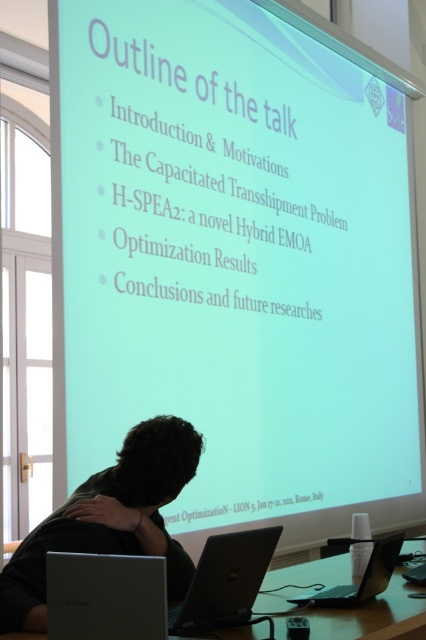
You are a photographer standing at the back of the room. You want to take a photo of the person presenting, focusing on their black matte hair at lower left. Considering the distance, will you need to use a zoom lens to capture the hair clearly?

The black matte hair at lower left is 5.72 feet from the viewer. Since this distance is relatively close, a standard lens might suffice without needing a zoom lens for clarity.

You are standing in the presentation room and see the point marked at coordinates (x=356, y=614). What object is located at that point?

The point marked at coordinates (x=356, y=614) corresponds to the white plastic table at lower center.